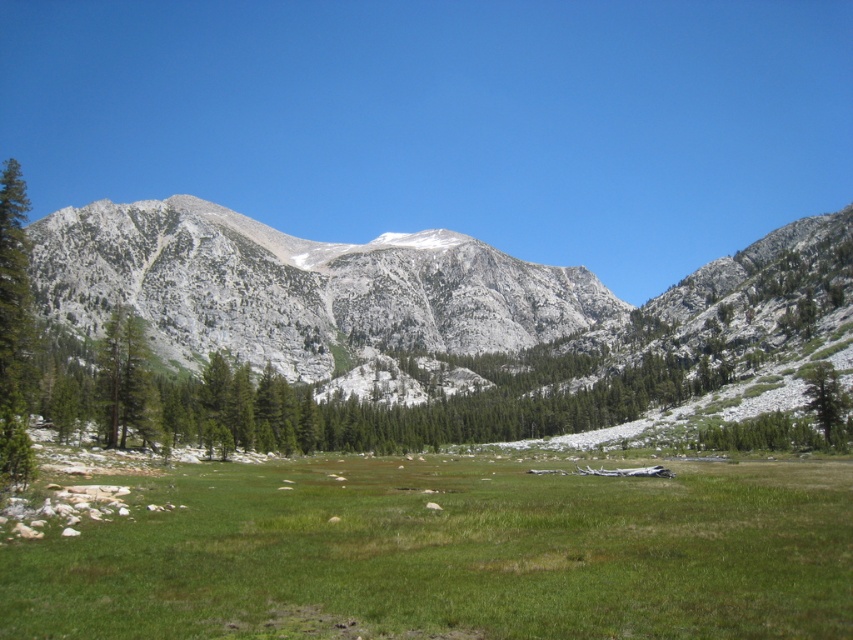
Is point (204, 564) positioned behind point (260, 241)?

No, (204, 564) is in front of (260, 241).

Does green grassy field at center have a lesser width compared to white rocky mountain at center?

Indeed, green grassy field at center has a lesser width compared to white rocky mountain at center.

You are a GUI agent. You are given a task and a screenshot of the screen. Output one action in this format:
    pyautogui.click(x=<x>, y=<y>)
    Task: Click on the green grassy field at center
    The image size is (853, 640).
    Given the screenshot: What is the action you would take?
    pyautogui.click(x=450, y=554)

The width and height of the screenshot is (853, 640). I want to click on green grassy field at center, so click(450, 554).

Is point (363, 278) closer to viewer compared to point (811, 380)?

No, it is not.

Is white rocky mountain at center to the left of green textured tree at right from the viewer's perspective?

Indeed, white rocky mountain at center is positioned on the left side of green textured tree at right.

I want to click on white rocky mountain at center, so click(299, 289).

Does green grassy field at center have a larger size compared to green textured tree at right?

Yes, green grassy field at center is bigger than green textured tree at right.

Is point (410, 518) positioned behind point (845, 403)?

No, (410, 518) is closer to viewer.

This screenshot has width=853, height=640. In order to click on green grassy field at center in this screenshot , I will do pos(450,554).